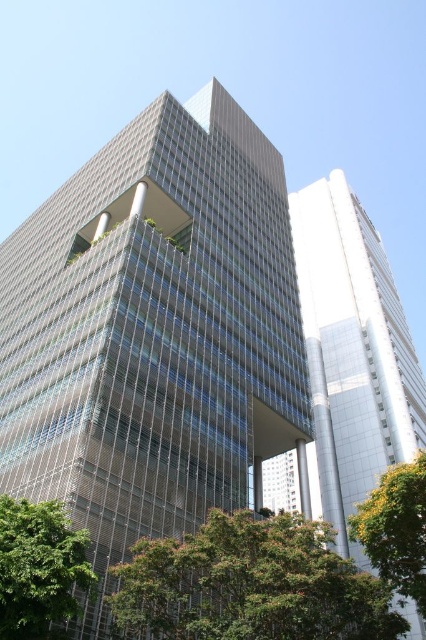
Question: Can you confirm if sleek silver building at right is wider than green leafy tree at lower left?

Choices:
 (A) no
 (B) yes

Answer: (B)

Question: Is green leafy tree at lower center positioned behind green leafy tree at lower right?

Choices:
 (A) no
 (B) yes

Answer: (A)

Question: Among these objects, which one is nearest to the camera?

Choices:
 (A) green leafy tree at lower center
 (B) green leafy tree at lower right
 (C) green leafy tree at lower left
 (D) sleek silver building at right

Answer: (C)

Question: Can you confirm if metallic glass building at center is smaller than green leafy tree at lower right?

Choices:
 (A) no
 (B) yes

Answer: (A)

Question: Which point is closer to the camera?

Choices:
 (A) (34, 259)
 (B) (54, 513)
 (C) (241, 624)
 (D) (345, 294)

Answer: (C)

Question: Among these points, which one is farthest from the camera?

Choices:
 (A) (336, 593)
 (B) (212, 468)

Answer: (B)